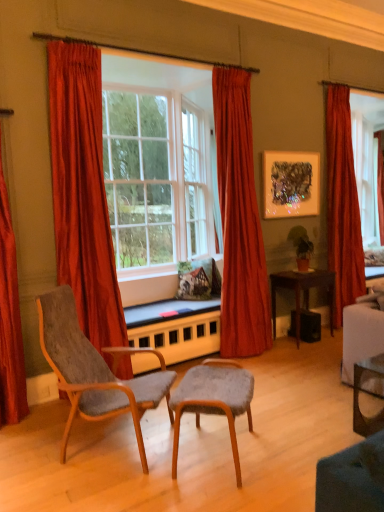
This screenshot has height=512, width=384. I want to click on free space below velvet grey stool at center, arranged as the second chair when viewed from the left (from a real-world perspective), so click(x=211, y=454).